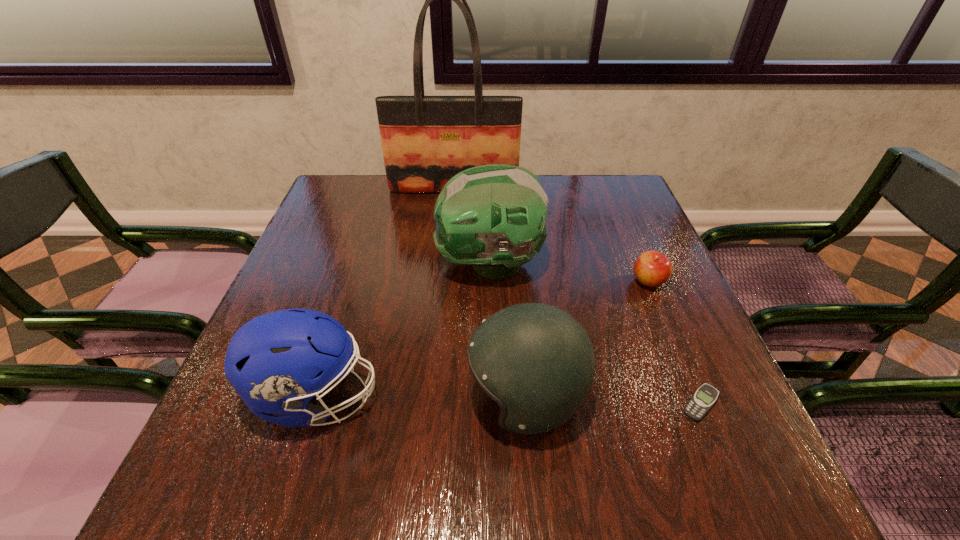
Identify which football helmet is the nearest to the farthest object. Please provide its 2D coordinates. Your answer should be formatted as a tuple, i.e. [(x, y)], where the tuple contains the x and y coordinates of a point satisfying the conditions above.

[(493, 216)]

At what (x,y) coordinates should I click in order to perform the action: click on vacant region that satisfies the following two spatial constraints: 1. on the front-facing side of the beeper; 2. on the right side of the shopping bag. Please return your answer as a coordinate pair (x, y). The image size is (960, 540). Looking at the image, I should click on (435, 404).

You are a GUI agent. You are given a task and a screenshot of the screen. Output one action in this format:
    pyautogui.click(x=<x>, y=<y>)
    Task: Click on the free space that satisfies the following two spatial constraints: 1. on the visor of the beeper; 2. on the left side of the second tallest object
    This screenshot has height=540, width=960.
    Given the screenshot: What is the action you would take?
    pyautogui.click(x=492, y=404)

This screenshot has height=540, width=960. I want to click on vacant space that satisfies the following two spatial constraints: 1. on the front-facing side of the leftmost football helmet; 2. on the left side of the beeper, so click(314, 404).

Identify the location of vacant space that satisfies the following two spatial constraints: 1. on the front-facing side of the leftmost football helmet; 2. on the left side of the beeper. The image size is (960, 540). (314, 404).

Where is `vacant space that satisfies the following two spatial constraints: 1. on the back side of the fifth tallest object; 2. on the visor of the tallest football helmet`? Image resolution: width=960 pixels, height=540 pixels. vacant space that satisfies the following two spatial constraints: 1. on the back side of the fifth tallest object; 2. on the visor of the tallest football helmet is located at coordinates 641,264.

What are the coordinates of `free space that satisfies the following two spatial constraints: 1. on the front-facing side of the leftmost football helmet; 2. on the right side of the beeper` in the screenshot? It's located at [314, 404].

The width and height of the screenshot is (960, 540). I want to click on free space that satisfies the following two spatial constraints: 1. on the front-facing side of the farthest object; 2. on the front-facing side of the leftmost football helmet, so click(x=435, y=397).